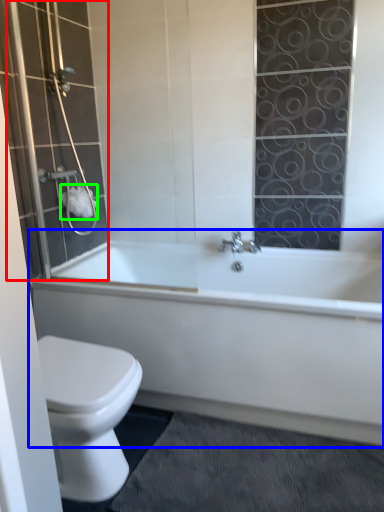
Question: Considering the real-world distances, which object is closest to shower door (highlighted by a red box)? bathtub (highlighted by a blue box) or toilet paper (highlighted by a green box).

Choices:
 (A) bathtub
 (B) toilet paper

Answer: (B)